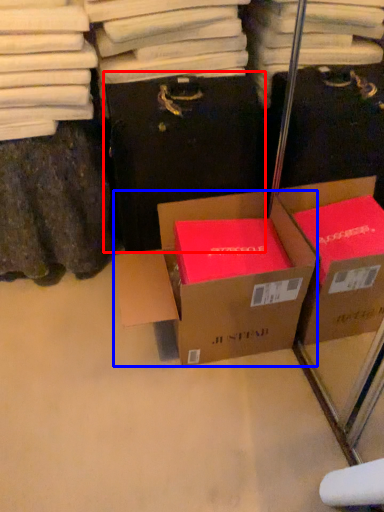
Question: Which of the following is the closest to the observer, cardboard box (highlighted by a red box) or box (highlighted by a blue box)?

Choices:
 (A) cardboard box
 (B) box

Answer: (B)